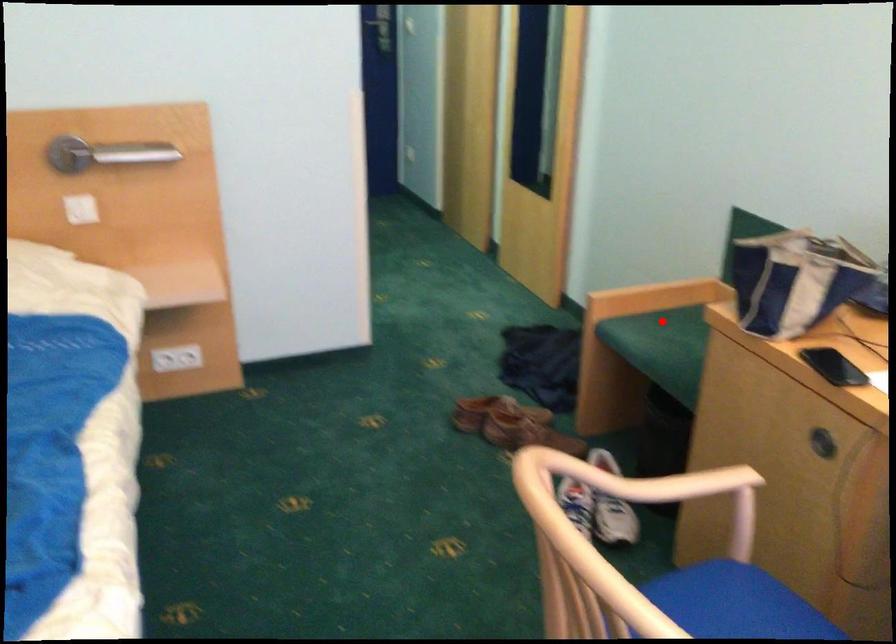
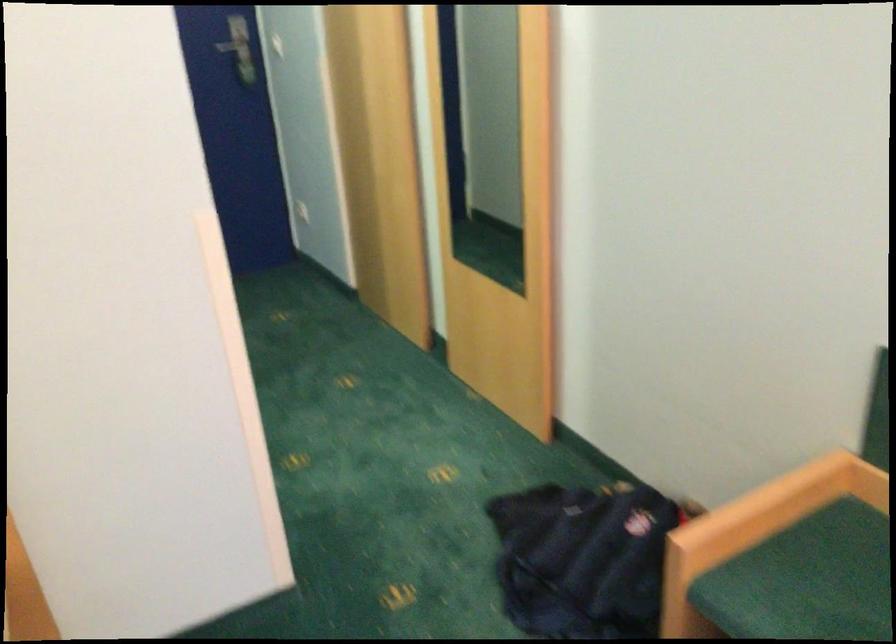
The point at the highlighted location is marked in the first image. Where is the corresponding point in the second image?

(806, 580)